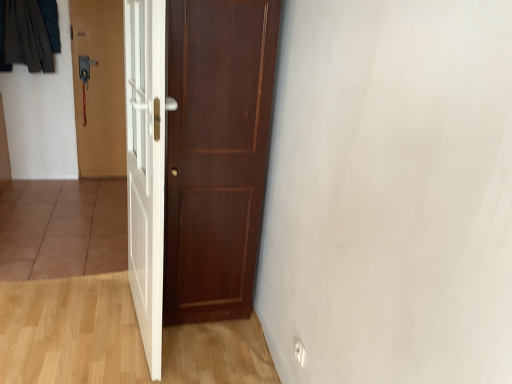
Question: In terms of size, does white glossy door at center, the third door when ordered from back to front, appear bigger or smaller than matte wood door at center, which appears as the second door when viewed from the back?

Choices:
 (A) small
 (B) big

Answer: (A)

Question: In terms of width, does white glossy door at center, which is the first door from front to back, look wider or thinner when compared to matte wood door at center, which appears as the second door when viewed from the back?

Choices:
 (A) wide
 (B) thin

Answer: (B)

Question: Estimate the real-world distances between objects in this image. Which object is closer to the matte wood door at center, which is the 3th door in left-to-right order?

Choices:
 (A) wooden door at left, positioned as the 3th door in front-to-back order
 (B) white glossy door at center, the third door when ordered from back to front
 (C) dark gray fabric at upper left

Answer: (B)

Question: Based on their relative distances, which object is nearer to the matte wood door at center, marked as the second door in a front-to-back arrangement?

Choices:
 (A) wooden door at left, arranged as the first door when viewed from the back
 (B) white glossy door at center, positioned as the second door in right-to-left order
 (C) dark gray fabric at upper left

Answer: (B)